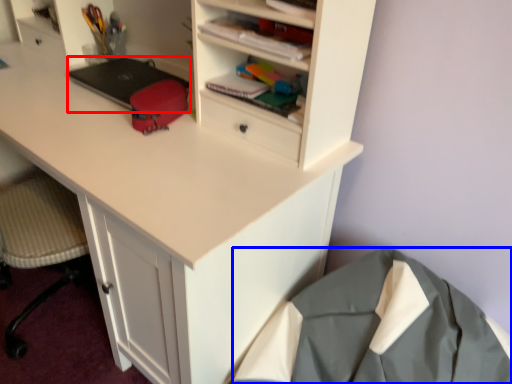
Question: Which object appears closest to the camera in this image, laptop (highlighted by a red box) or clothing (highlighted by a blue box)?

Choices:
 (A) laptop
 (B) clothing

Answer: (B)